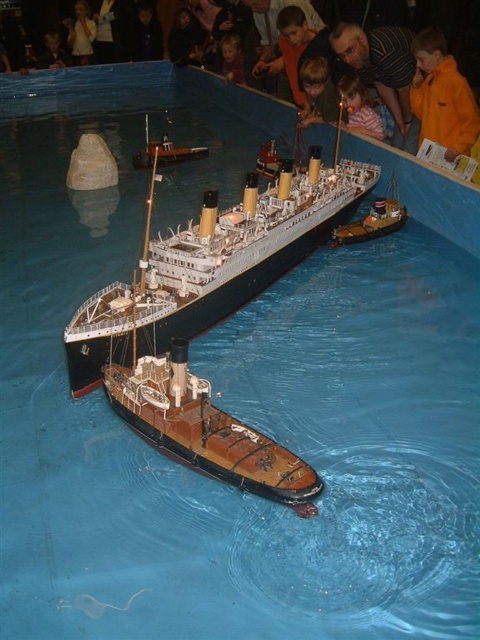
You are a museum visitor who wants to take a photo of the wooden ship at center and the smooth skin child at upper center together in the frame. Based on their sizes, do you think they can both fit in the same photo without cropping either of them?

The wooden ship at center might be wider than smooth skin child at upper center, so there is a possibility that both can fit in the same photo if the camera is positioned appropriately to capture both widths.

You are a visitor standing in front of the Titanic model exhibit. You notice an orange fleece jacket at upper right and a smooth skin child at upper center. Which object is nearer to you?

The orange fleece jacket at upper right is closer to the viewer than the smooth skin child at upper center.

You are a museum visitor standing in front of the ship exhibit. You notice two ships in the display case. The first is a polished wood ship at center, and the second is a wooden ship at center. Which one is closer to you?

The polished wood ship at center is closer to you because it is positioned under the wooden ship at center, meaning it is in front.